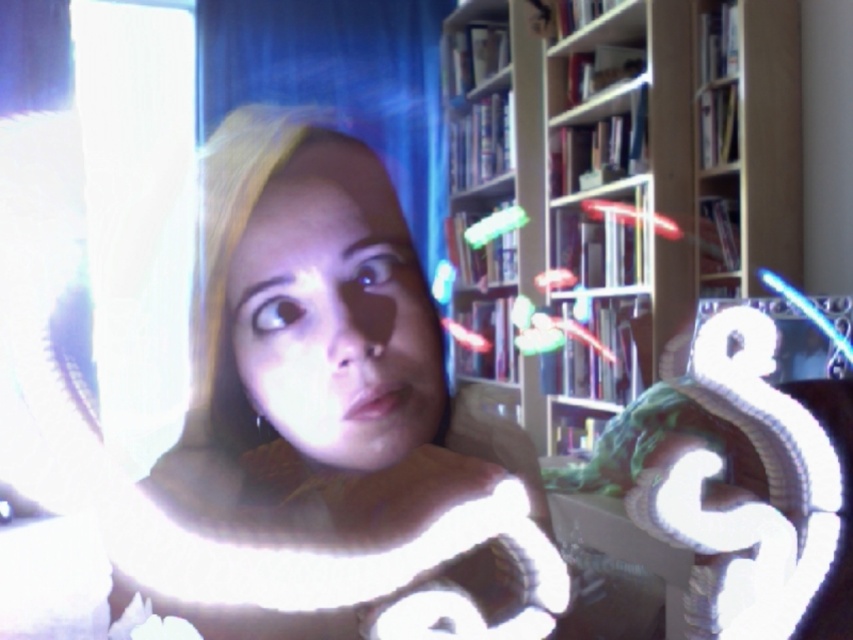
Which is behind, point (442, 486) or point (627, 38)?

The point (627, 38) is behind.

Identify the location of matte white scarf at center. The width and height of the screenshot is (853, 640). [x=334, y=404].

Looking at this image, is matte white scarf at center above matte skin face at center?

No.

Is point (381, 173) more distant than point (329, 172)?

Yes, it is.

Identify the location of matte white scarf at center. (334, 404).

Which is more to the left, wooden bookshelf at center or matte skin face at center?

From the viewer's perspective, matte skin face at center appears more on the left side.

What do you see at coordinates (643, 147) in the screenshot? I see `wooden bookshelf at center` at bounding box center [643, 147].

This screenshot has width=853, height=640. Find the location of `wooden bookshelf at center`. wooden bookshelf at center is located at coordinates (643, 147).